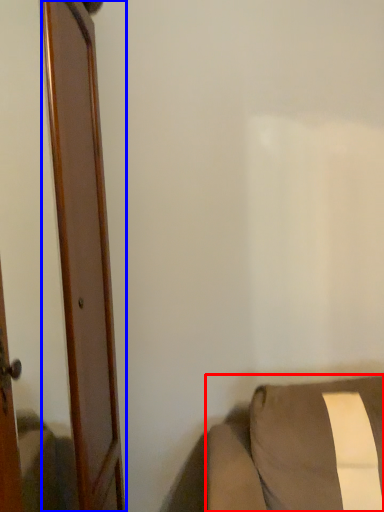
Question: Which point is further to the camera, furniture (highlighted by a red box) or door (highlighted by a blue box)?

Choices:
 (A) furniture
 (B) door

Answer: (A)